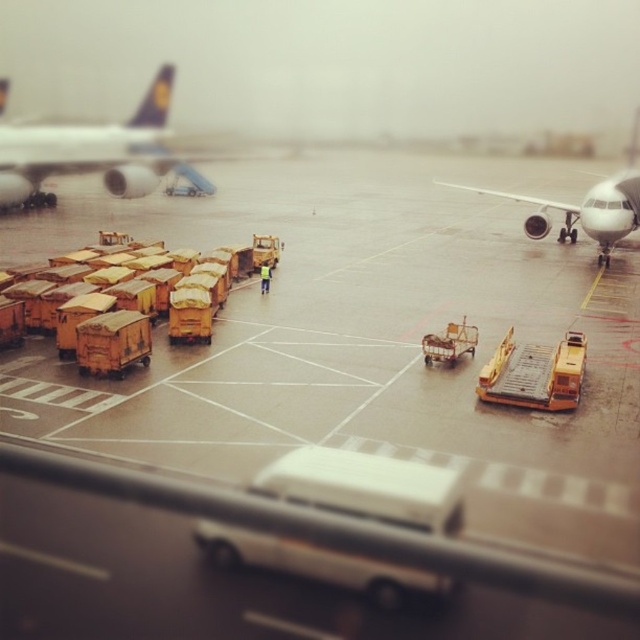
Question: Considering the real-world distances, which object is closest to the white glossy airplane at upper left?

Choices:
 (A) white glossy airplane at right
 (B) yellow matte cargo containers at left

Answer: (B)

Question: Does white glossy airplane at upper left appear under white glossy airplane at right?

Choices:
 (A) no
 (B) yes

Answer: (A)

Question: Does white glossy airplane at upper left have a smaller size compared to white glossy airplane at right?

Choices:
 (A) yes
 (B) no

Answer: (A)

Question: Which point appears farthest from the camera in this image?

Choices:
 (A) (632, 196)
 (B) (81, 310)
 (C) (458, 353)

Answer: (A)

Question: Estimate the real-world distances between objects in this image. Which object is farther from the white glossy airplane at right?

Choices:
 (A) yellow matte cargo containers at left
 (B) metallic yellow cart at center

Answer: (A)

Question: Is white glossy airplane at upper left wider than white glossy airplane at right?

Choices:
 (A) yes
 (B) no

Answer: (B)